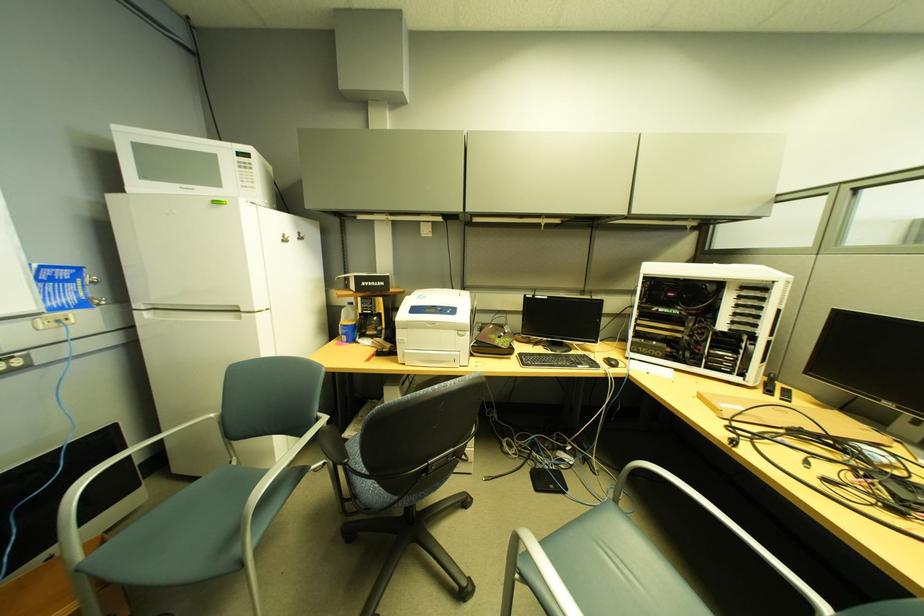
This screenshot has height=616, width=924. In order to click on overhead cabinet handle in this screenshot , I will do `click(292, 237)`.